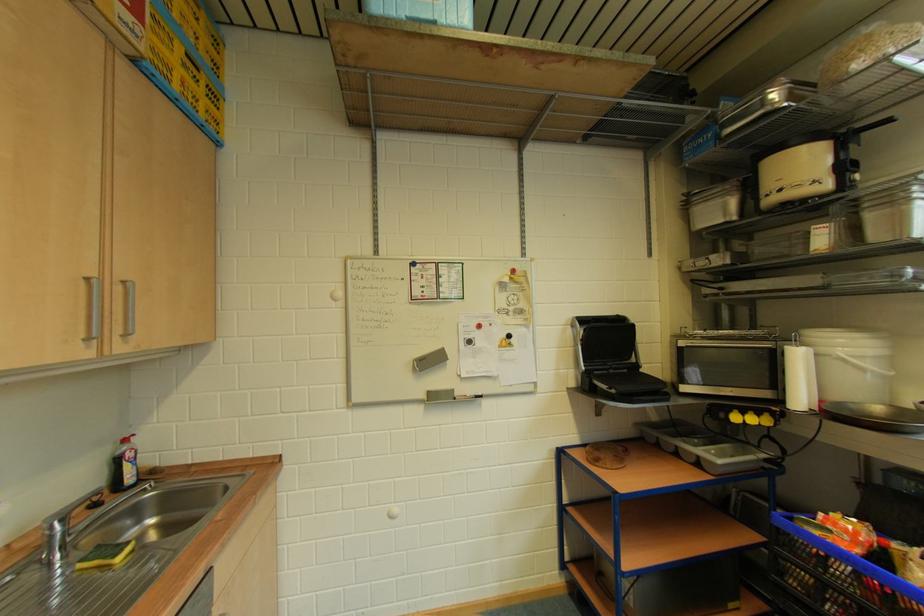
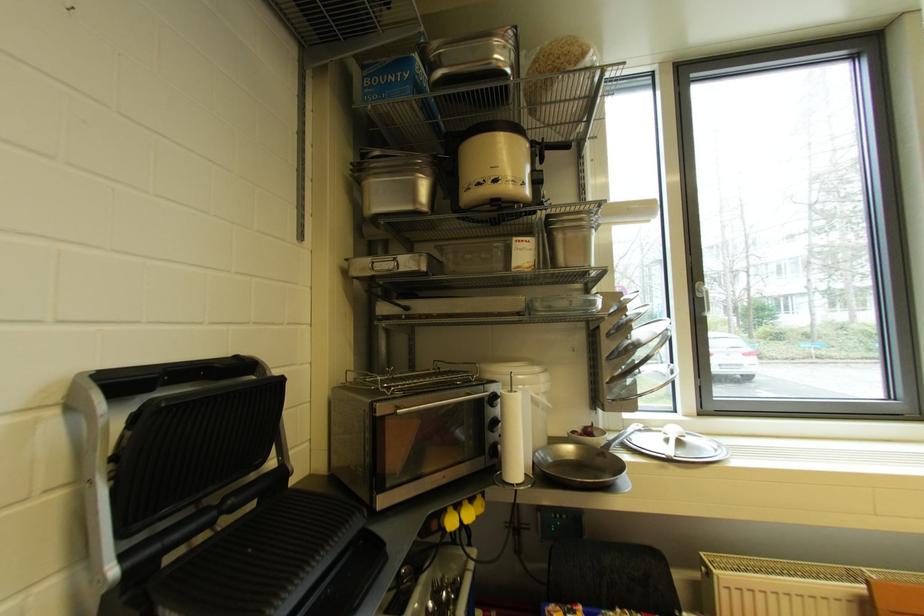
Find the pixel in the second image that matches pixel 727 224 in the first image.

(418, 211)